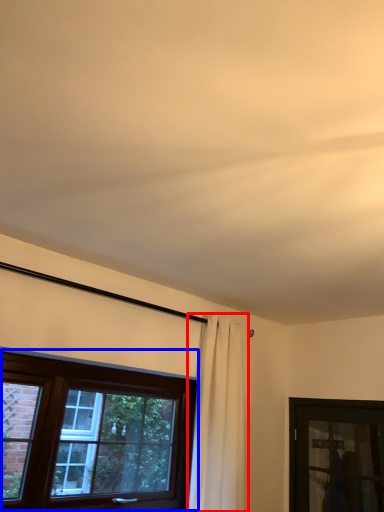
Question: Which of the following is the farthest to the observer, curtain (highlighted by a red box) or window (highlighted by a blue box)?

Choices:
 (A) curtain
 (B) window

Answer: (A)